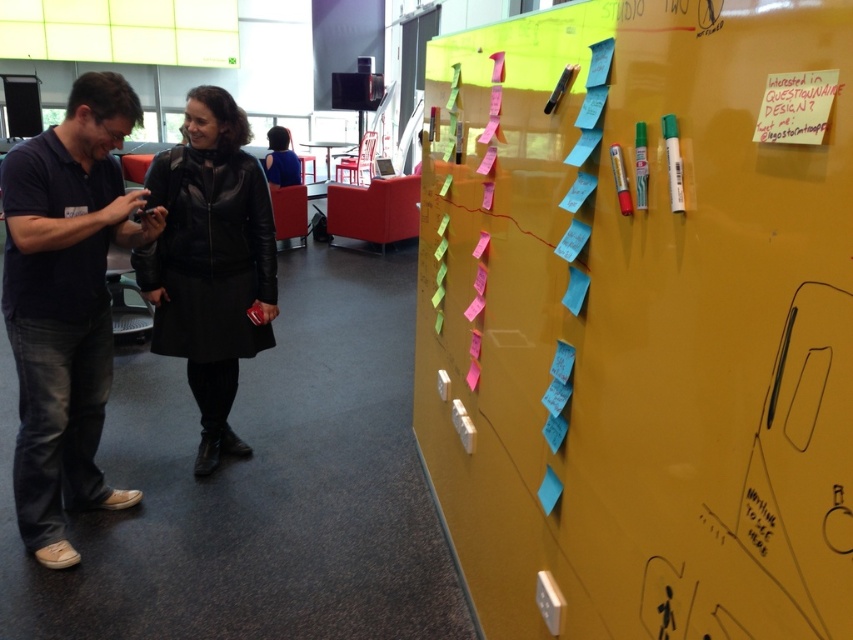
What do you see at coordinates (642, 317) in the screenshot? I see `yellow matte bulletin board at upper right` at bounding box center [642, 317].

Is point (712, 516) positioned after point (267, 193)?

No, it is not.

Measure the distance between yellow matte bulletin board at upper right and camera.

25.49 inches

Find the location of a particular element. yellow matte bulletin board at upper right is located at coordinates (642, 317).

Can you confirm if yellow matte bulletin board at upper right is bigger than leather jacket at center?

Indeed, yellow matte bulletin board at upper right has a larger size compared to leather jacket at center.

Does yellow matte bulletin board at upper right appear on the right side of leather jacket at center?

Yes, yellow matte bulletin board at upper right is to the right of leather jacket at center.

Where is `yellow matte bulletin board at upper right`? This screenshot has width=853, height=640. yellow matte bulletin board at upper right is located at coordinates (642, 317).

Between dark blue cotton shirt at left and leather jacket at center, which one is positioned lower?

Positioned lower is dark blue cotton shirt at left.

Who is taller, dark blue cotton shirt at left or leather jacket at center?

dark blue cotton shirt at left

Between point (64, 445) and point (283, 129), which one is positioned behind?

The point (283, 129) is more distant.

The height and width of the screenshot is (640, 853). What are the coordinates of `dark blue cotton shirt at left` in the screenshot? It's located at (67, 305).